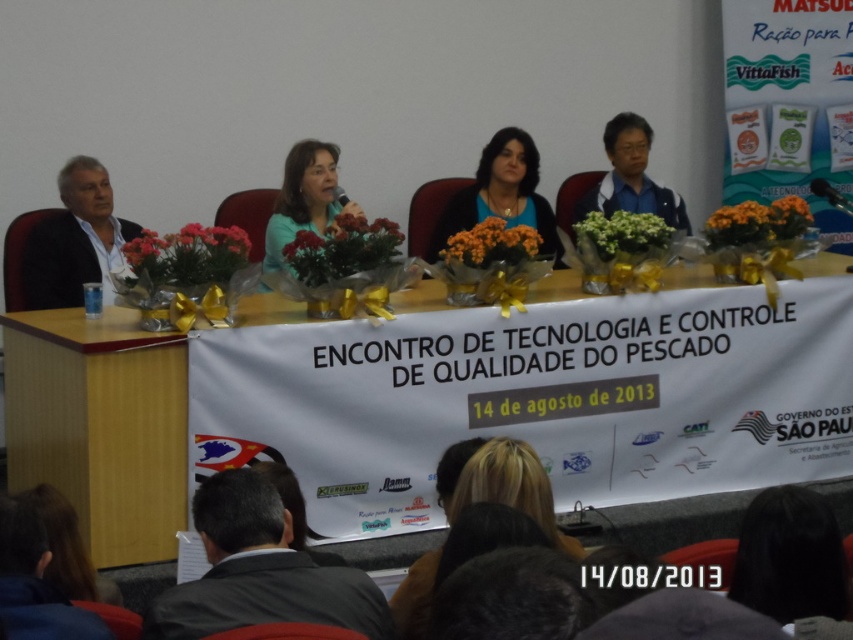
Question: Where is wooden table at center located in relation to blue matte shirt at center in the image?

Choices:
 (A) below
 (B) above

Answer: (A)

Question: Which of the following is the closest to the observer?

Choices:
 (A) wooden table at center
 (B) blonde hair at center
 (C) matte green shirt at center
 (D) blue matte shirt at center

Answer: (B)

Question: Is blonde hair at center bigger than blue matte shirt at center?

Choices:
 (A) no
 (B) yes

Answer: (B)

Question: Which point is closer to the camera?

Choices:
 (A) blonde hair at center
 (B) wooden table at center

Answer: (A)

Question: Estimate the real-world distances between objects in this image. Which object is farther from the blonde hair at center?

Choices:
 (A) blue matte shirt at center
 (B) wooden table at center
 (C) matte green shirt at center

Answer: (A)

Question: Does blonde hair at center appear on the left side of matte green shirt at center?

Choices:
 (A) yes
 (B) no

Answer: (B)